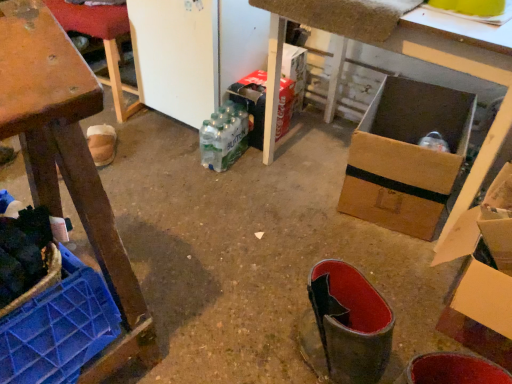
Question: Is brown cardboard box at center positioned in front of cardboard box at right, positioned as the 1th cardboard box in right-to-left order?

Choices:
 (A) no
 (B) yes

Answer: (A)

Question: From the image's perspective, is brown cardboard box at center below cardboard box at right, which is counted as the 2th cardboard box, starting from the left?

Choices:
 (A) no
 (B) yes

Answer: (A)

Question: Is brown cardboard box at center bigger than cardboard box at right, positioned as the 1th cardboard box in right-to-left order?

Choices:
 (A) yes
 (B) no

Answer: (A)

Question: Does brown cardboard box at center turn towards cardboard box at right, which is counted as the 2th cardboard box, starting from the left?

Choices:
 (A) no
 (B) yes

Answer: (A)

Question: Is the position of brown cardboard box at center more distant than that of cardboard box at right, arranged as the 1th cardboard box when viewed from the front?

Choices:
 (A) yes
 (B) no

Answer: (A)

Question: Considering the positions of wooden crate at left, which is the 2th furniture in top-to-bottom order, and wooden table at left, the 2th furniture ordered from the bottom, in the image, is wooden crate at left, which is the 2th furniture in top-to-bottom order, wider or thinner than wooden table at left, the 2th furniture ordered from the bottom,?

Choices:
 (A) thin
 (B) wide

Answer: (A)

Question: From a real-world perspective, relative to wooden table at left, placed as the 1th furniture when sorted from top to bottom, is wooden crate at left, which is the 2th furniture in top-to-bottom order, vertically above or below?

Choices:
 (A) above
 (B) below

Answer: (A)

Question: Is wooden crate at left, the first furniture from the bottom, taller or shorter than wooden table at left, placed as the 1th furniture when sorted from top to bottom?

Choices:
 (A) short
 (B) tall

Answer: (B)

Question: Considering their positions, is wooden crate at left, acting as the 1th furniture starting from the front, located in front of or behind wooden table at left, arranged as the first furniture when viewed from the back?

Choices:
 (A) front
 (B) behind

Answer: (A)

Question: Relative to cardboard box at right, positioned as the 1th cardboard box in right-to-left order, is wooden crate at left, the first furniture from the bottom, in front or behind?

Choices:
 (A) behind
 (B) front

Answer: (B)

Question: Considering the positions of wooden crate at left, which is the 2th furniture in top-to-bottom order, and cardboard box at right, arranged as the 1th cardboard box when viewed from the front, in the image, is wooden crate at left, which is the 2th furniture in top-to-bottom order, wider or thinner than cardboard box at right, arranged as the 1th cardboard box when viewed from the front,?

Choices:
 (A) wide
 (B) thin

Answer: (A)

Question: From the image's perspective, relative to cardboard box at right, which is counted as the 2th cardboard box, starting from the left, is wooden crate at left, acting as the 1th furniture starting from the front, above or below?

Choices:
 (A) above
 (B) below

Answer: (B)

Question: In terms of height, does wooden crate at left, the 2th furniture from the back, look taller or shorter compared to cardboard box at right, positioned as the 1th cardboard box in right-to-left order?

Choices:
 (A) short
 (B) tall

Answer: (B)

Question: Considering the positions of cardboard box at center, which ranks as the 1th cardboard box in left-to-right order, and cardboard box at right, positioned as the 1th cardboard box in right-to-left order, in the image, is cardboard box at center, which ranks as the 1th cardboard box in left-to-right order, bigger or smaller than cardboard box at right, positioned as the 1th cardboard box in right-to-left order,?

Choices:
 (A) small
 (B) big

Answer: (A)

Question: Considering the positions of cardboard box at center, which is counted as the 2th cardboard box, starting from the front, and cardboard box at right, the 2th cardboard box from the back, in the image, is cardboard box at center, which is counted as the 2th cardboard box, starting from the front, wider or thinner than cardboard box at right, the 2th cardboard box from the back,?

Choices:
 (A) thin
 (B) wide

Answer: (B)